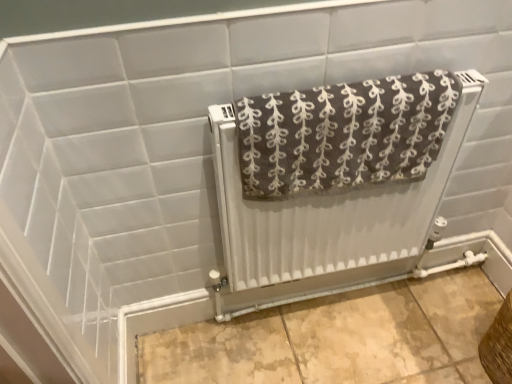
Question: From the image's perspective, is brown textured towel at center on top of brown woven basket at lower right?

Choices:
 (A) yes
 (B) no

Answer: (A)

Question: Is there a large distance between brown textured towel at center and brown woven basket at lower right?

Choices:
 (A) yes
 (B) no

Answer: (B)

Question: Is brown textured towel at center not within brown woven basket at lower right?

Choices:
 (A) no
 (B) yes

Answer: (B)

Question: Does brown textured towel at center appear on the left side of brown woven basket at lower right?

Choices:
 (A) no
 (B) yes

Answer: (B)

Question: Can you confirm if brown textured towel at center is thinner than brown woven basket at lower right?

Choices:
 (A) yes
 (B) no

Answer: (A)

Question: Can you confirm if brown textured towel at center is smaller than brown woven basket at lower right?

Choices:
 (A) no
 (B) yes

Answer: (A)

Question: Is white textured radiator at center located outside brown textured towel at center?

Choices:
 (A) no
 (B) yes

Answer: (B)

Question: Considering the relative sizes of white textured radiator at center and brown textured towel at center in the image provided, is white textured radiator at center wider than brown textured towel at center?

Choices:
 (A) yes
 (B) no

Answer: (B)

Question: Does white textured radiator at center have a smaller size compared to brown textured towel at center?

Choices:
 (A) yes
 (B) no

Answer: (B)

Question: Can you confirm if white textured radiator at center is taller than brown textured towel at center?

Choices:
 (A) yes
 (B) no

Answer: (A)

Question: Does white textured radiator at center turn towards brown textured towel at center?

Choices:
 (A) yes
 (B) no

Answer: (A)

Question: Considering the relative sizes of white textured radiator at center and brown textured towel at center in the image provided, is white textured radiator at center shorter than brown textured towel at center?

Choices:
 (A) yes
 (B) no

Answer: (B)

Question: Is brown textured towel at center to the left of white textured radiator at center from the viewer's perspective?

Choices:
 (A) yes
 (B) no

Answer: (A)